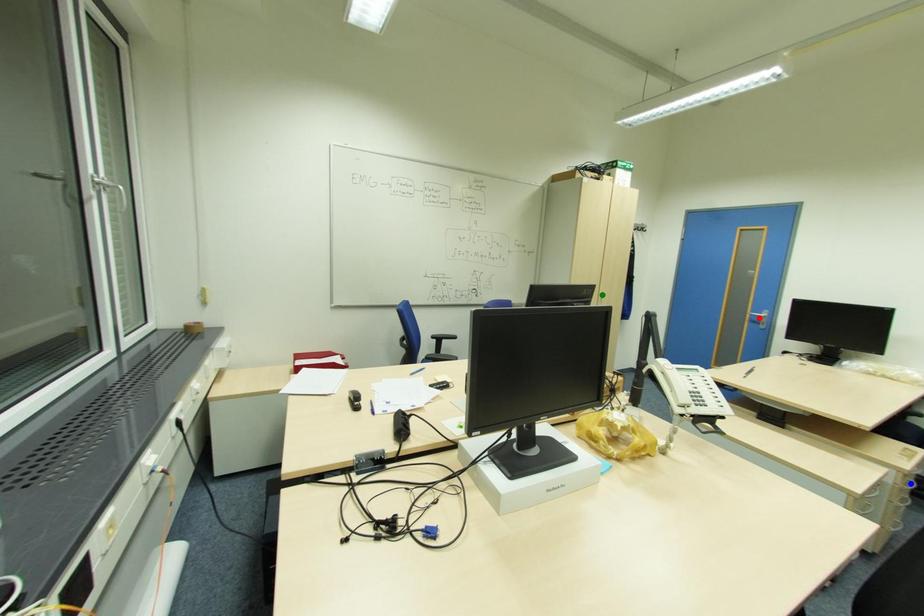
Order these from nearest to farthest:
red point, blue point, green point

blue point → green point → red point